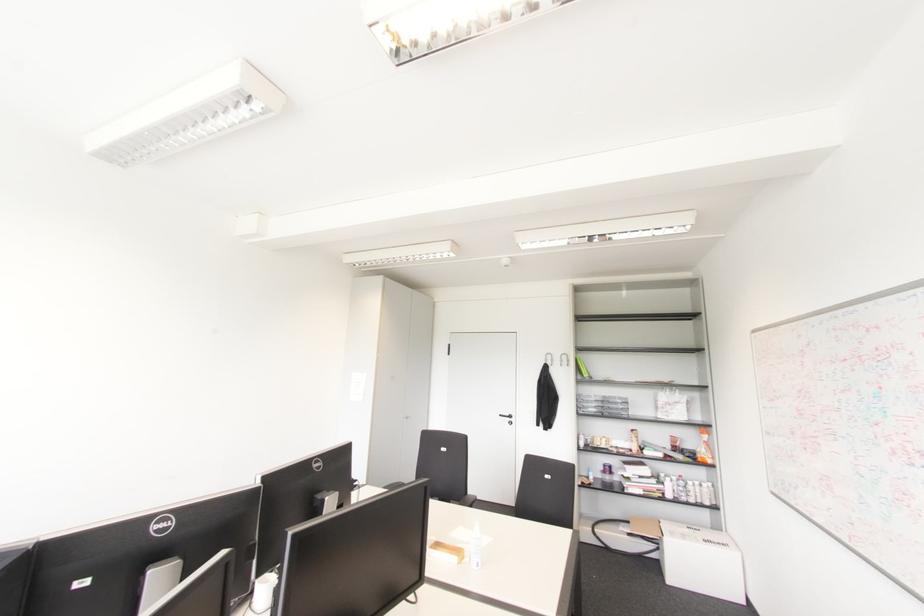
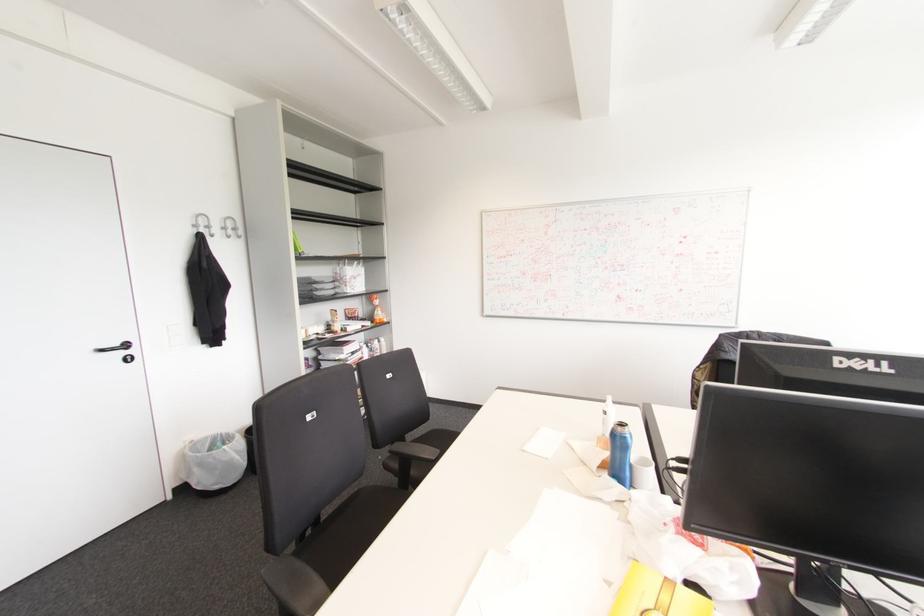
Locate, in the second image, the point that corresponds to (566,360) in the first image.

(234, 229)